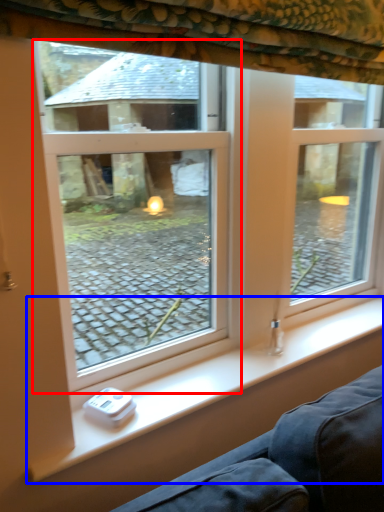
Question: Which point is closer to the camera, window (highlighted by a red box) or window sill (highlighted by a blue box)?

Choices:
 (A) window
 (B) window sill

Answer: (A)